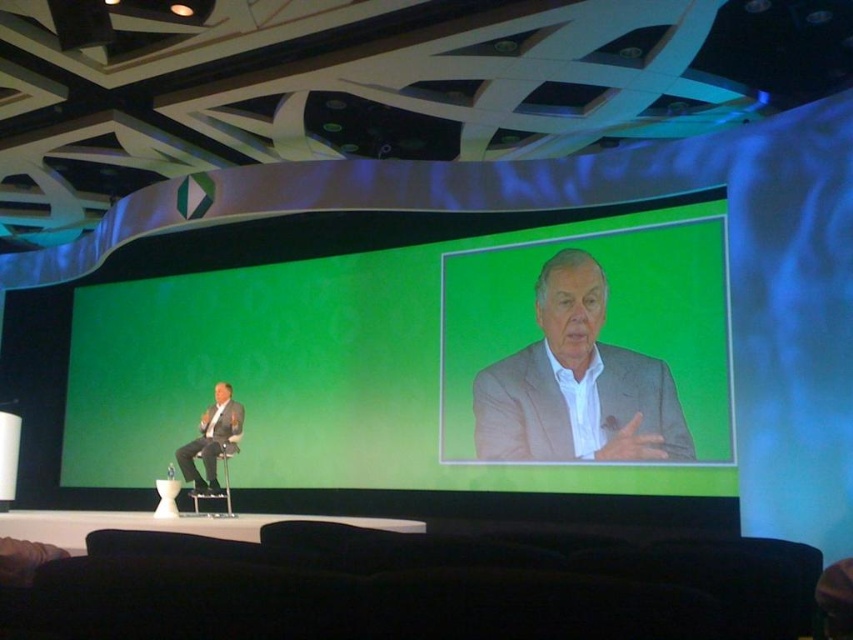
Question: Among these objects, which one is farthest from the camera?

Choices:
 (A) green matte/projection screen at center
 (B) metallic silver chair at left

Answer: (B)

Question: Can you confirm if green matte/projection screen at center is positioned to the left of metallic silver chair at left?

Choices:
 (A) no
 (B) yes

Answer: (A)

Question: Which of the following is the closest to the observer?

Choices:
 (A) metallic silver chair at left
 (B) green matte/projection screen at center

Answer: (B)

Question: Does gray suit at center appear over matte gray suit at center?

Choices:
 (A) no
 (B) yes

Answer: (B)

Question: Does matte gray suit at center come behind metallic silver chair at left?

Choices:
 (A) yes
 (B) no

Answer: (A)

Question: Which point appears farthest from the camera in this image?

Choices:
 (A) (368, 296)
 (B) (564, 276)
 (C) (224, 394)
 (D) (204, 493)

Answer: (A)